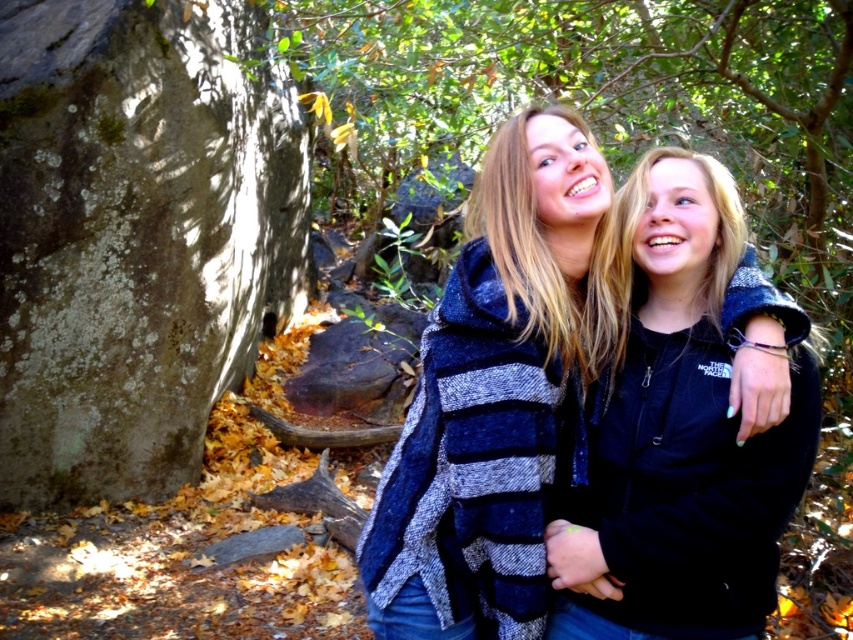
You are planning to take a photo of the gray mossy rock at left and the green leafy tree at center in this scene. Since you want both subjects to be clearly visible in the frame, which object should you focus on first to ensure proper depth of field?

The gray mossy rock at left has a lesser height compared to the green leafy tree at center, so you should focus on the green leafy tree at center first to ensure both are in focus since it is taller and farther away.

You are standing at point (136, 236) in a forest scene. You see a gray mossy rock at left. What is located at your current position?

The gray mossy rock at left is located at point (136, 236).

You are trying to decide which of the two people in the scene is taller. You notice both the black fleece jacket at center and the blue striped sweater at center. Based on their clothing sizes, which person might be taller?

The black fleece jacket at center is larger in size than the blue striped sweater at center, so the person wearing the black fleece jacket at center is likely taller.